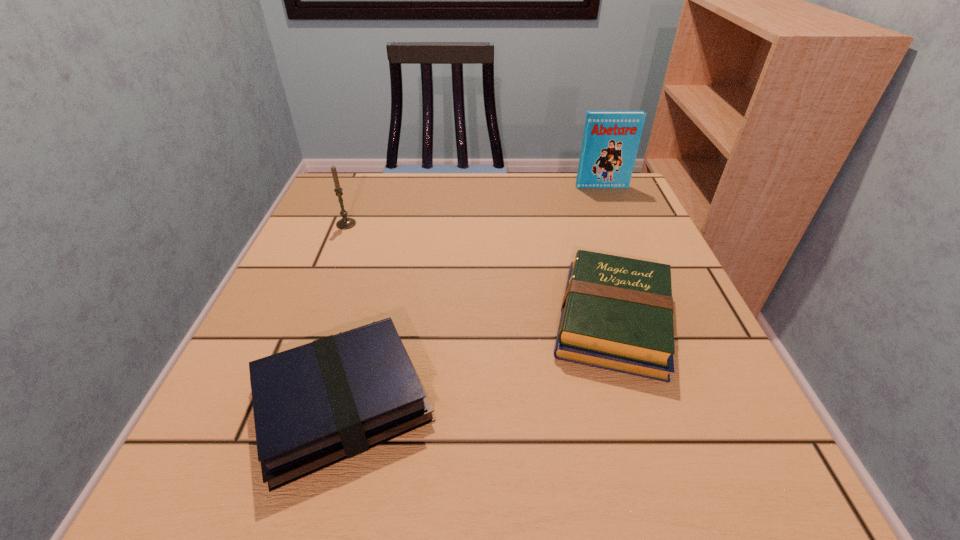
Where is `object at the near edge`? Image resolution: width=960 pixels, height=540 pixels. object at the near edge is located at coordinates (317, 404).

The width and height of the screenshot is (960, 540). I want to click on candle that is at the left edge, so click(345, 223).

Locate an element on the screen. The height and width of the screenshot is (540, 960). book present at the left edge is located at coordinates (317, 404).

Where is `object present at the far left corner`? The image size is (960, 540). object present at the far left corner is located at coordinates (345, 223).

Find the location of a particular element. The height and width of the screenshot is (540, 960). object positioned at the near left corner is located at coordinates (317, 404).

This screenshot has height=540, width=960. I want to click on object at the far right corner, so click(611, 139).

The height and width of the screenshot is (540, 960). I want to click on vacant space at the far edge of the desktop, so click(563, 219).

The height and width of the screenshot is (540, 960). In order to click on vacant area at the near edge in this screenshot , I will do `click(452, 464)`.

Image resolution: width=960 pixels, height=540 pixels. What are the coordinates of `vacant space at the left edge of the desktop` in the screenshot? It's located at (320, 269).

Locate an element on the screen. The height and width of the screenshot is (540, 960). vacant area at the right edge of the desktop is located at coordinates (616, 239).